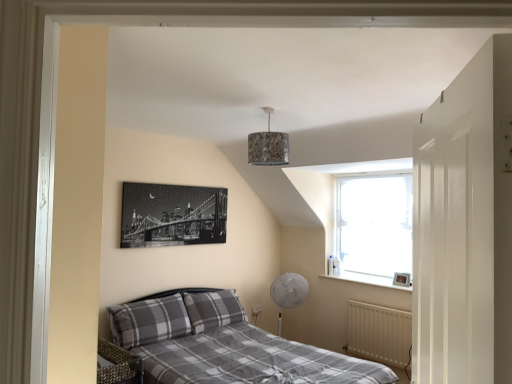
The width and height of the screenshot is (512, 384). Describe the element at coordinates (223, 345) in the screenshot. I see `plaid fabric bed at center` at that location.

What do you see at coordinates (172, 215) in the screenshot? I see `black and white canvas at upper left, the first picture frame from the top` at bounding box center [172, 215].

This screenshot has height=384, width=512. What are the coordinates of `camouflage fabric lampshade at center` in the screenshot? It's located at (268, 146).

Which is correct: gray plaid pillow at center, the 1th pillow in the right-to-left sequence, is inside plaid fabric bed at center, or outside of it?

gray plaid pillow at center, the 1th pillow in the right-to-left sequence, exists entirely within plaid fabric bed at center.

Is gray plaid pillow at center, the 1th pillow in the right-to-left sequence, next to plaid fabric bed at center and touching it?

No, gray plaid pillow at center, the 1th pillow in the right-to-left sequence, is not next to plaid fabric bed at center.

Which is behind, gray plaid pillow at center, which is the second pillow in left-to-right order, or plaid fabric bed at center?

gray plaid pillow at center, which is the second pillow in left-to-right order, is further from the camera.

Considering the sizes of objects gray plaid pillow at center, the 1th pillow in the right-to-left sequence, and plaid fabric bed at center in the image provided, who is thinner, gray plaid pillow at center, the 1th pillow in the right-to-left sequence, or plaid fabric bed at center?

gray plaid pillow at center, the 1th pillow in the right-to-left sequence, is thinner.

Does black and white canvas at upper left, the first picture frame from the top, touch gray plaid pillow at lower left, the 1th pillow in the left-to-right sequence?

There is a gap between black and white canvas at upper left, the first picture frame from the top, and gray plaid pillow at lower left, the 1th pillow in the left-to-right sequence.

Is point (150, 186) in front of point (121, 326)?

No.

Is black and white canvas at upper left, arranged as the 2th picture frame when viewed from the right, located outside gray plaid pillow at lower left, the 1th pillow in the left-to-right sequence?

Yes, black and white canvas at upper left, arranged as the 2th picture frame when viewed from the right, is located beyond the bounds of gray plaid pillow at lower left, the 1th pillow in the left-to-right sequence.

Considering the positions of objects black and white canvas at upper left, the first picture frame from the top, and gray plaid pillow at lower left, the 1th pillow in the left-to-right sequence, in the image provided, who is in front, black and white canvas at upper left, the first picture frame from the top, or gray plaid pillow at lower left, the 1th pillow in the left-to-right sequence,?

gray plaid pillow at lower left, the 1th pillow in the left-to-right sequence.

Is white textured window at upper right inside or outside of white glossy door at right?

white textured window at upper right is located beyond the bounds of white glossy door at right.

The width and height of the screenshot is (512, 384). Identify the location of dresser below the white textured window at upper right (from a real-world perspective). (465, 226).

From a real-world perspective, relative to white glossy door at right, is white textured window at upper right vertically above or below?

white textured window at upper right is above white glossy door at right.

How different are the orientations of white textured window at upper right and white glossy door at right in degrees?

They differ by 54 degrees in their facing directions.

Looking at this image, how many degrees apart are the facing directions of metallic silver picture frame at upper right, positioned as the 2th picture frame in top-to-bottom order, and camouflage fabric lampshade at center?

The facing directions of metallic silver picture frame at upper right, positioned as the 2th picture frame in top-to-bottom order, and camouflage fabric lampshade at center are 95.8 degrees apart.

From the image's perspective, would you say metallic silver picture frame at upper right, marked as the 1th picture frame in a bottom-to-top arrangement, is shown under camouflage fabric lampshade at center?

Correct, metallic silver picture frame at upper right, marked as the 1th picture frame in a bottom-to-top arrangement, appears lower than camouflage fabric lampshade at center in the image.

Between metallic silver picture frame at upper right, acting as the second picture frame starting from the left, and camouflage fabric lampshade at center, which one appears on the left side from the viewer's perspective?

Positioned to the left is camouflage fabric lampshade at center.

Find the location of a particular element. The image size is (512, 384). lamp above the metallic silver picture frame at upper right, positioned as the 2th picture frame in top-to-bottom order (from the image's perspective) is located at coordinates (268, 146).

Locate an element on the screen. window on the right of plaid fabric bed at center is located at coordinates (374, 220).

Looking at this image, how many degrees apart are the facing directions of plaid fabric bed at center and white textured window at upper right?

The facing directions of plaid fabric bed at center and white textured window at upper right are 88.9 degrees apart.

Considering the positions of point (144, 320) and point (410, 246), is point (144, 320) closer or farther from the camera than point (410, 246)?

Point (144, 320).

From the image's perspective, is white matte radiator at lower right located above or below gray plaid pillow at center, which is the second pillow in left-to-right order?

white matte radiator at lower right is below gray plaid pillow at center, which is the second pillow in left-to-right order.

From the image's perspective, count 2nd pillows upward from the white matte radiator at lower right and point to it. Please provide its 2D coordinates.

[(213, 309)]

Is white matte radiator at lower right wider or thinner than gray plaid pillow at center, which is the second pillow in left-to-right order?

Considering their sizes, white matte radiator at lower right looks slimmer than gray plaid pillow at center, which is the second pillow in left-to-right order.

Based on the photo, in the image, is plaid fabric bed at center positioned in front of or behind black and white canvas at upper left, the first picture frame from the top?

In the image, plaid fabric bed at center appears in front of black and white canvas at upper left, the first picture frame from the top.

Is plaid fabric bed at center wider or thinner than black and white canvas at upper left, which is the 1th picture frame from left to right?

plaid fabric bed at center is wider than black and white canvas at upper left, which is the 1th picture frame from left to right.

Is plaid fabric bed at center taller or shorter than black and white canvas at upper left, arranged as the 2th picture frame when viewed from the right?

In the image, plaid fabric bed at center appears to be taller than black and white canvas at upper left, arranged as the 2th picture frame when viewed from the right.

How far apart are plaid fabric bed at center and black and white canvas at upper left, arranged as the 2th picture frame when viewed from the right?

They are 38.65 inches apart.

The width and height of the screenshot is (512, 384). Identify the location of bed below the gray plaid pillow at center, the 1th pillow in the right-to-left sequence (from a real-world perspective). (223, 345).

I want to click on pillow in front of the black and white canvas at upper left, arranged as the 2th picture frame when viewed from the right, so click(149, 321).

Which object lies nearer to the anchor point white matte radiator at lower right, gray plaid pillow at center, which is the second pillow in left-to-right order, or gray plaid pillow at lower left, placed as the 2th pillow when sorted from right to left?

The object closer to white matte radiator at lower right is gray plaid pillow at center, which is the second pillow in left-to-right order.

Based on their spatial positions, is metallic silver picture frame at upper right, the first picture frame positioned from the right, or camouflage fabric lampshade at center closer to gray plaid pillow at center, which is the second pillow in left-to-right order?

metallic silver picture frame at upper right, the first picture frame positioned from the right.

Estimate the real-world distances between objects in this image. Which object is further from camouflage fabric lampshade at center, metallic silver picture frame at upper right, acting as the second picture frame starting from the left, or white matte radiator at lower right?

white matte radiator at lower right is further to camouflage fabric lampshade at center.

Estimate the real-world distances between objects in this image. Which object is further from plaid fabric bed at center, black and white canvas at upper left, arranged as the 2th picture frame when viewed from the right, or white textured window at upper right?

The object further to plaid fabric bed at center is white textured window at upper right.

When comparing their distances from gray plaid pillow at lower left, the 1th pillow in the left-to-right sequence, does camouflage fabric lampshade at center or gray plaid pillow at center, the 1th pillow in the right-to-left sequence, seem closer?

gray plaid pillow at center, the 1th pillow in the right-to-left sequence, lies closer to gray plaid pillow at lower left, the 1th pillow in the left-to-right sequence, than the other object.

Based on their spatial positions, is white matte radiator at lower right or plaid fabric bed at center further from metallic silver picture frame at upper right, acting as the second picture frame starting from the left?

Among the two, plaid fabric bed at center is located further to metallic silver picture frame at upper right, acting as the second picture frame starting from the left.

In the scene shown: Which object lies nearer to the anchor point plaid fabric bed at center, gray plaid pillow at center, the 1th pillow in the right-to-left sequence, or metallic silver picture frame at upper right, the first picture frame positioned from the right?

gray plaid pillow at center, the 1th pillow in the right-to-left sequence, lies closer to plaid fabric bed at center than the other object.

Which object lies nearer to the anchor point camouflage fabric lampshade at center, white glossy door at right or white textured window at upper right?

Based on the image, white textured window at upper right appears to be nearer to camouflage fabric lampshade at center.

Where is `radiator between white glossy door at right and metallic silver picture frame at upper right, the first picture frame positioned from the right, in the front-back direction`? radiator between white glossy door at right and metallic silver picture frame at upper right, the first picture frame positioned from the right, in the front-back direction is located at coordinates (379, 334).

Locate an element on the screen. The image size is (512, 384). pillow between black and white canvas at upper left, the first picture frame from the top, and gray plaid pillow at lower left, the 1th pillow in the left-to-right sequence, from top to bottom is located at coordinates (213, 309).

The image size is (512, 384). I want to click on pillow located between black and white canvas at upper left, which is the 2th picture frame in bottom-to-top order, and metallic silver picture frame at upper right, the first picture frame positioned from the right, in the left-right direction, so click(x=213, y=309).

Find the location of a particular element. The height and width of the screenshot is (384, 512). pillow between black and white canvas at upper left, which is the 1th picture frame from left to right, and white textured window at upper right is located at coordinates (213, 309).